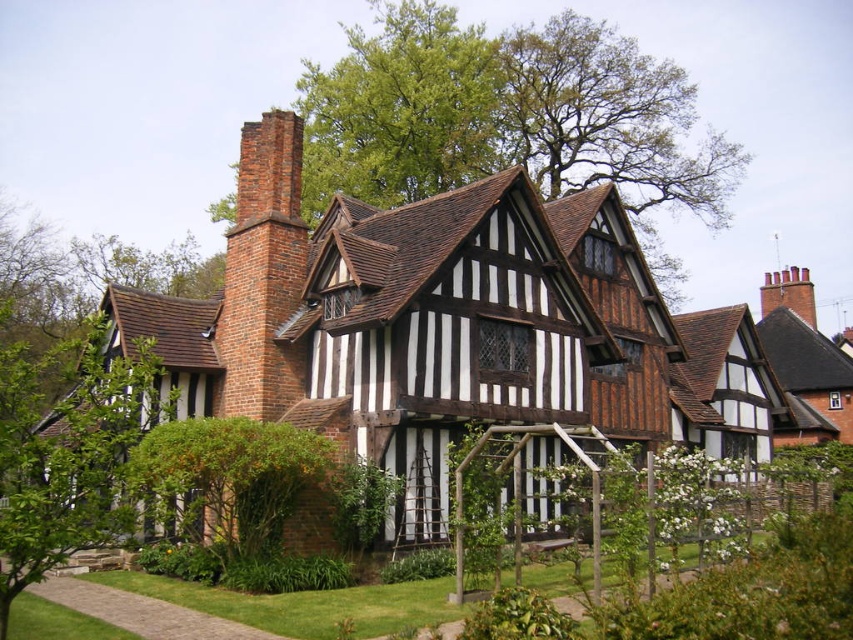
You are standing at the front door of the Tudor house and notice a point marked at coordinates [68,454]. Which object does this point correspond to?

The point at [68,454] corresponds to the green leafy bush at left.

You are standing at the front gate of the Tudor house and want to know which plant is taller between the green leafy tree at upper center and the green leafy bush at left. Can you tell me?

The green leafy tree at upper center is taller than the green leafy bush at left.